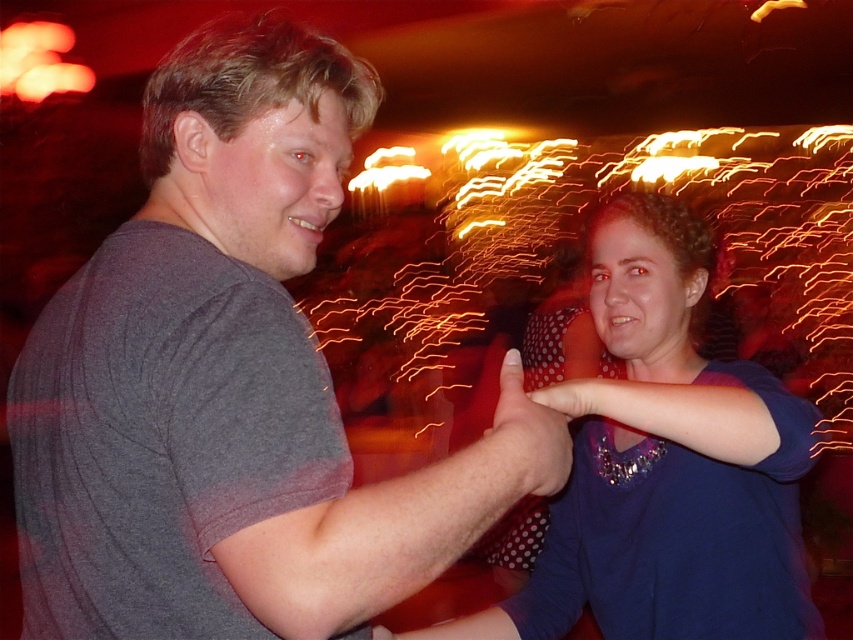
You are at the center of the scene and want to reach the point closer to the bottom edge of the image. Which point should you move towards, point (202, 598) or point (524, 593)?

Point (202, 598) is closer to the bottom edge of the image, so you should move towards point (202, 598).